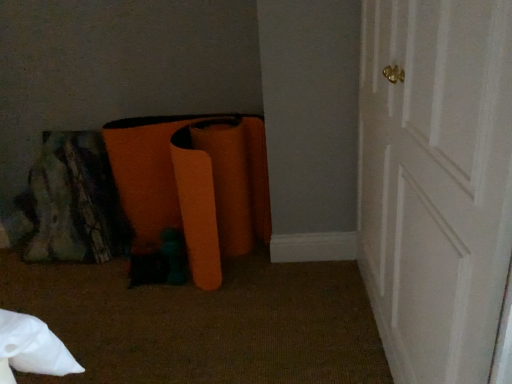
Question: Is white wood door at right in front of or behind orange fabric bean bag at lower left in the image?

Choices:
 (A) front
 (B) behind

Answer: (A)

Question: Is white wood door at right taller or shorter than orange fabric bean bag at lower left?

Choices:
 (A) tall
 (B) short

Answer: (A)

Question: From a real-world perspective, is white wood door at right positioned above or below orange fabric bean bag at lower left?

Choices:
 (A) above
 (B) below

Answer: (A)

Question: Is orange fabric bean bag at lower left in front of or behind white wood door at right in the image?

Choices:
 (A) front
 (B) behind

Answer: (B)

Question: In the image, is orange fabric bean bag at lower left on the left side or the right side of white wood door at right?

Choices:
 (A) right
 (B) left

Answer: (B)

Question: From a real-world perspective, is orange fabric bean bag at lower left positioned above or below white wood door at right?

Choices:
 (A) above
 (B) below

Answer: (B)

Question: Is orange fabric bean bag at lower left taller or shorter than white wood door at right?

Choices:
 (A) short
 (B) tall

Answer: (A)